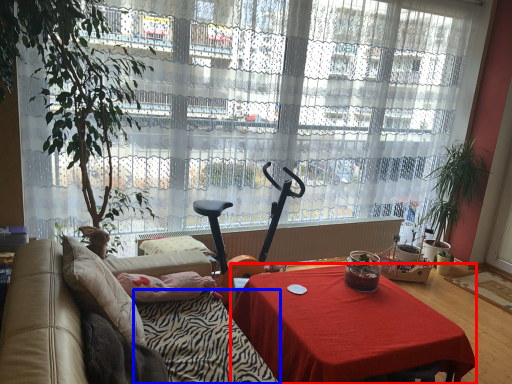
Question: Which object is closer to the camera taking this photo, desk (highlighted by a red box) or blanket (highlighted by a blue box)?

Choices:
 (A) desk
 (B) blanket

Answer: (B)